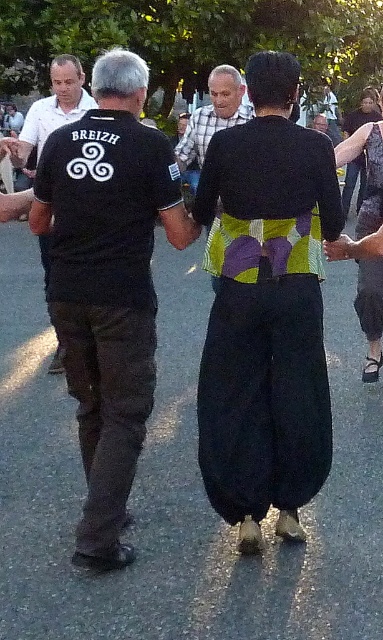
You are a photographer at the event and want to capture both the checkered shirt at center and the green and purple fabric skirt at center in the same frame. Given that your camera has a fixed focal length, which object should you focus on to ensure both are in the frame?

The checkered shirt at center is larger in size than the green and purple fabric skirt at center, so focusing on the checkered shirt at center will help keep both objects in the frame since it occupies more space.

You are a photographer trying to capture the traditional dance performance. You notice the checkered shirt at center and the green and purple fabric skirt at center. Which clothing item is covering the other in the image?

The checkered shirt at center is positioned over the green and purple fabric skirt at center, so it is covering the skirt.